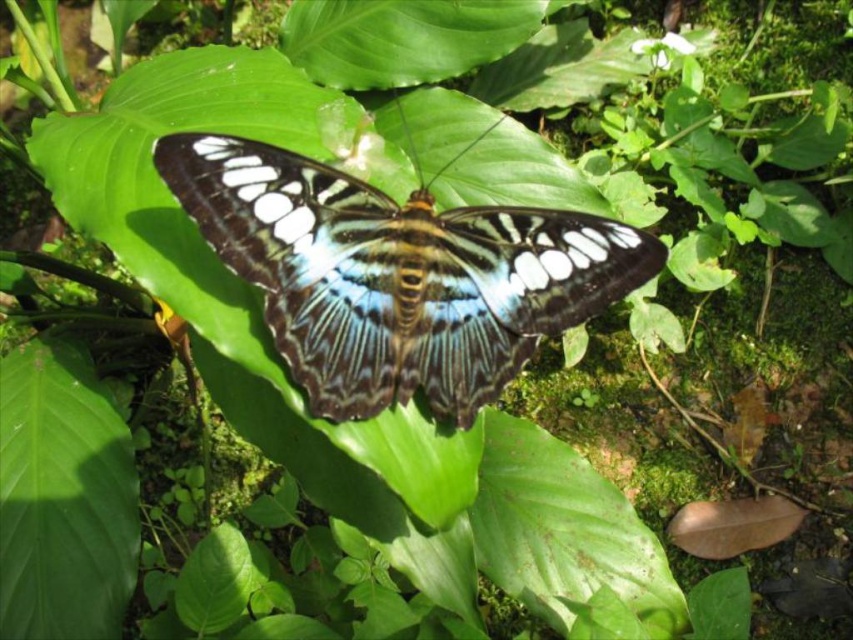
You are an entomologist observing the translucent iridescent butterfly at center and the green matte leaf at center. From your viewpoint, which object is closer to you?

The translucent iridescent butterfly at center is closer to you because it is positioned in front of the green matte leaf at center.

Looking at this image, you are an entomologist observing the scene. You need to determine the relative sizes of the two main subjects. Which object is taller between the translucent iridescent butterfly at center and the green matte leaf at center?

The translucent iridescent butterfly at center is shorter than the green matte leaf at center, so the green matte leaf at center is taller.

You are standing in a lush garden and see two points in the scene. The first point is at coordinate point (196, 164) and the second is at point (65, 556). Which point is closer to you?

Point (196, 164) is closer to the camera than point (65, 556), so the first point is closer to you.